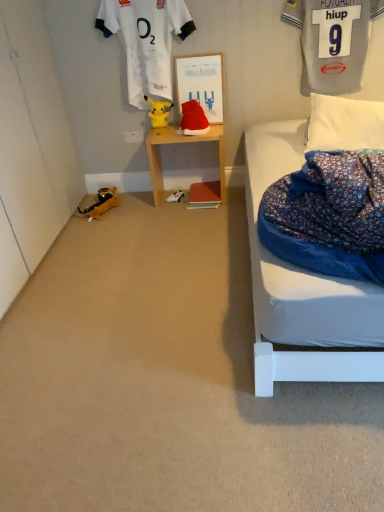
The width and height of the screenshot is (384, 512). Identify the location of free spot to the right of yellow rubber duck at lower left, positioned as the 1th toy in bottom-to-top order. (144, 203).